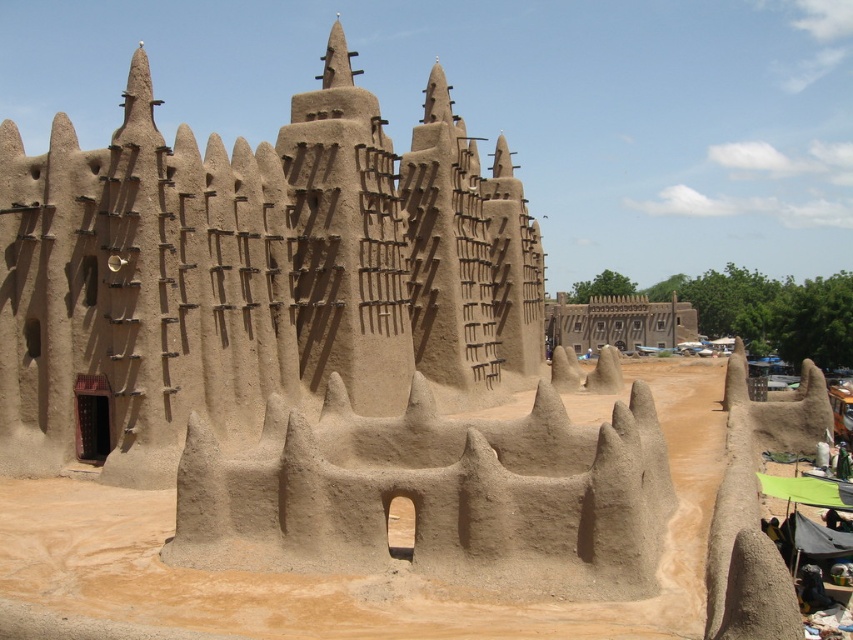
Question: Among these objects, which one is nearest to the camera?

Choices:
 (A) brown mud wall at center
 (B) sandy beige mud at center

Answer: (A)

Question: Can you confirm if sandy beige mud at center is positioned above brown mud wall at center?

Choices:
 (A) no
 (B) yes

Answer: (B)

Question: Which object appears farthest from the camera in this image?

Choices:
 (A) sandy beige mud at center
 (B) brown mud wall at center

Answer: (A)

Question: Is sandy beige mud at center further to the viewer compared to brown mud wall at center?

Choices:
 (A) yes
 (B) no

Answer: (A)

Question: Which point appears farthest from the camera in this image?

Choices:
 (A) (683, 625)
 (B) (178, 307)

Answer: (B)

Question: Is sandy beige mud at center above brown mud wall at center?

Choices:
 (A) yes
 (B) no

Answer: (A)